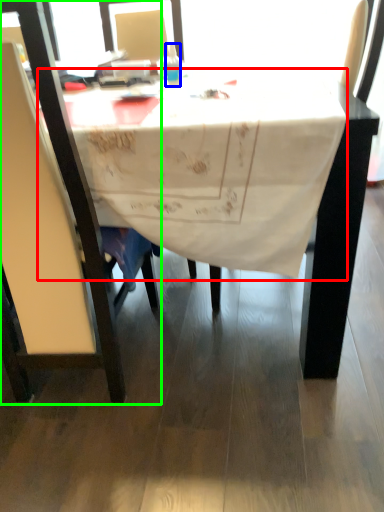
Question: Which object is the farthest from tablecloth (highlighted by a red box)? Choose among these: bottle (highlighted by a blue box) or chair (highlighted by a green box).

Choices:
 (A) bottle
 (B) chair

Answer: (A)